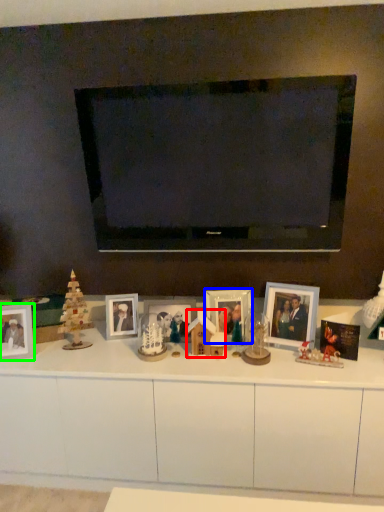
Question: Estimate the real-world distances between objects in this image. Which object is farther from toy (highlighted by a red box), picture frame (highlighted by a blue box) or picture frame (highlighted by a green box)?

Choices:
 (A) picture frame
 (B) picture frame

Answer: (B)